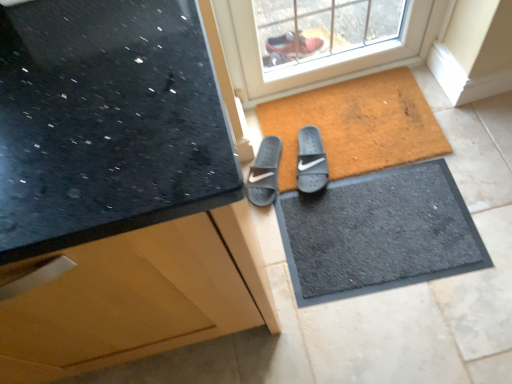
Question: Would you say brown textured mat at center is inside or outside matte black countertop at upper left?

Choices:
 (A) outside
 (B) inside

Answer: (A)

Question: Does point click(x=353, y=122) appear closer or farther from the camera than point click(x=88, y=11)?

Choices:
 (A) farther
 (B) closer

Answer: (A)

Question: Based on their relative distances, which object is nearer to the black rubber doormat at center?

Choices:
 (A) matte black countertop at upper left
 (B) gray rubber slide at center, which is the 1th footwear in left-to-right order
 (C) gray rubber slide at center, the 1th footwear in the right-to-left sequence
 (D) brown textured mat at center

Answer: (D)

Question: Considering the real-world distances, which object is closest to the gray rubber slide at center, the 1th footwear in the right-to-left sequence?

Choices:
 (A) gray rubber slide at center, the 2th footwear positioned from the right
 (B) black rubber doormat at center
 (C) brown textured mat at center
 (D) matte black countertop at upper left

Answer: (A)